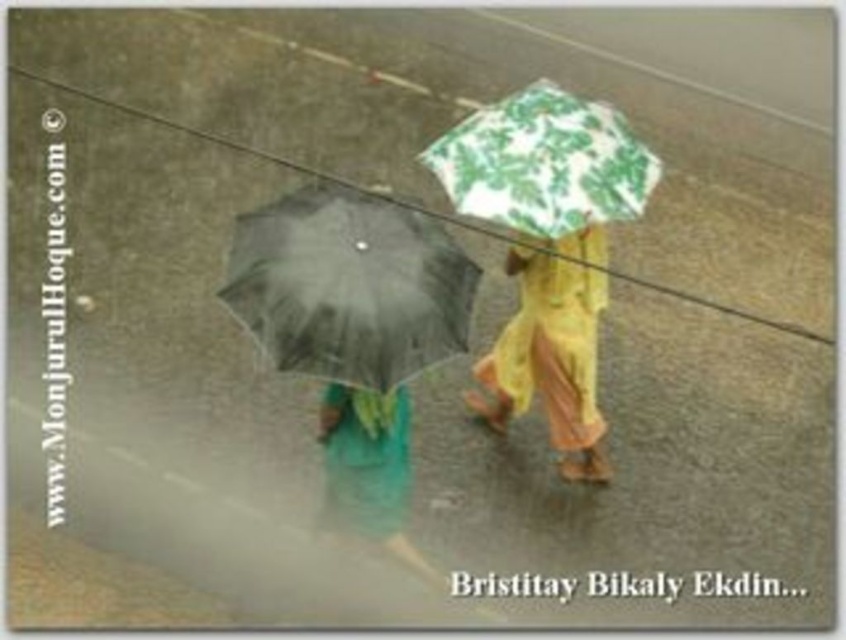
Can you confirm if green printed umbrella at upper center is bigger than yellow fabric umbrella at upper center?

Incorrect, green printed umbrella at upper center is not larger than yellow fabric umbrella at upper center.

Does point (624, 180) come behind point (526, 388)?

No, it is in front of (526, 388).

Which is behind, point (634, 172) or point (556, 330)?

The point (556, 330) is more distant.

Identify the location of green printed umbrella at upper center. (544, 163).

Between black matte umbrella at left and yellow fabric umbrella at upper center, which one is positioned lower?

yellow fabric umbrella at upper center is lower down.

Is point (419, 362) in front of point (487, 420)?

Yes, it is in front of point (487, 420).

Between point (361, 358) and point (603, 291), which one is positioned in front?

Point (361, 358) is more forward.

You are a GUI agent. You are given a task and a screenshot of the screen. Output one action in this format:
    pyautogui.click(x=<x>, y=<y>)
    Task: Click on the black matte umbrella at left
    The image size is (846, 640).
    Given the screenshot: What is the action you would take?
    pyautogui.click(x=349, y=285)

Is black matte umbrella at left to the right of green printed umbrella at upper center from the viewer's perspective?

No, black matte umbrella at left is not to the right of green printed umbrella at upper center.

Does point (300, 273) come farther from viewer compared to point (651, 163)?

No, (300, 273) is closer to viewer.

Identify the location of black matte umbrella at left. The height and width of the screenshot is (640, 846). (349, 285).